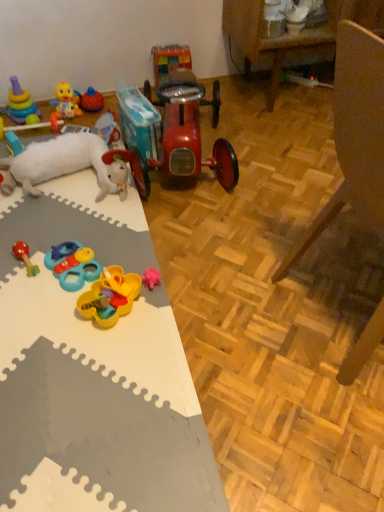
Find the location of `vacant space that's between yellow plastic toy at center, arranged as the 3th toy when viewed from the right, and plastic/soft yellow and blue toy at lower left, the 4th toy viewed from the right`. vacant space that's between yellow plastic toy at center, arranged as the 3th toy when viewed from the right, and plastic/soft yellow and blue toy at lower left, the 4th toy viewed from the right is located at coordinates (109, 264).